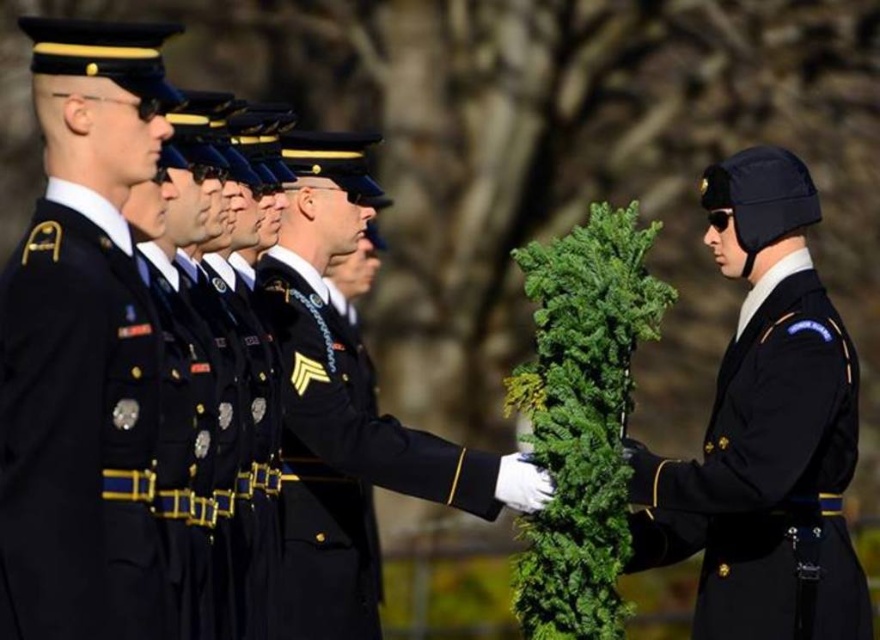
Question: Which object is the farthest from the dark blue woolen uniform at center?

Choices:
 (A) shiny black uniform at center
 (B) black wool uniform at right

Answer: (B)

Question: Does dark blue woolen uniform at center have a lesser width compared to black wool uniform at right?

Choices:
 (A) no
 (B) yes

Answer: (B)

Question: Which point is closer to the camera taking this photo?

Choices:
 (A) (341, 336)
 (B) (760, 586)
 (C) (39, 486)

Answer: (C)

Question: Does dark blue woolen uniform at center have a smaller size compared to shiny black uniform at center?

Choices:
 (A) yes
 (B) no

Answer: (B)

Question: Can you confirm if dark blue woolen uniform at center is smaller than shiny black uniform at center?

Choices:
 (A) yes
 (B) no

Answer: (B)

Question: Estimate the real-world distances between objects in this image. Which object is closer to the black wool uniform at right?

Choices:
 (A) shiny black uniform at center
 (B) dark blue woolen uniform at center

Answer: (A)